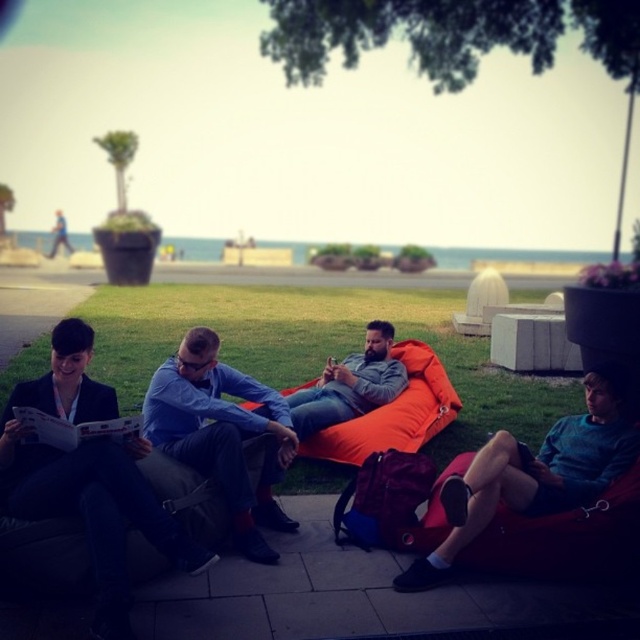
Question: Can you confirm if blue denim shirt at center is smaller than orange fabric bean bag at center?

Choices:
 (A) no
 (B) yes

Answer: (B)

Question: Is orange fabric bean bag at center below matte orange bean bag at center?

Choices:
 (A) yes
 (B) no

Answer: (A)

Question: Among these points, which one is nearest to the camera?

Choices:
 (A) (368, 432)
 (B) (51, 348)

Answer: (A)

Question: Which of the following is the farthest from the observer?

Choices:
 (A) matte orange bean bag at center
 (B) blue denim shirt at center
 (C) blue denim jeans at lower left
 (D) orange fabric bean bag at center

Answer: (A)

Question: Which point appears farthest from the camera in this image?

Choices:
 (A) (445, 388)
 (B) (371, 323)
 (C) (116, 509)

Answer: (A)

Question: Where is blue denim jeans at lower left located in relation to orange fabric bean bag at center in the image?

Choices:
 (A) right
 (B) left

Answer: (B)